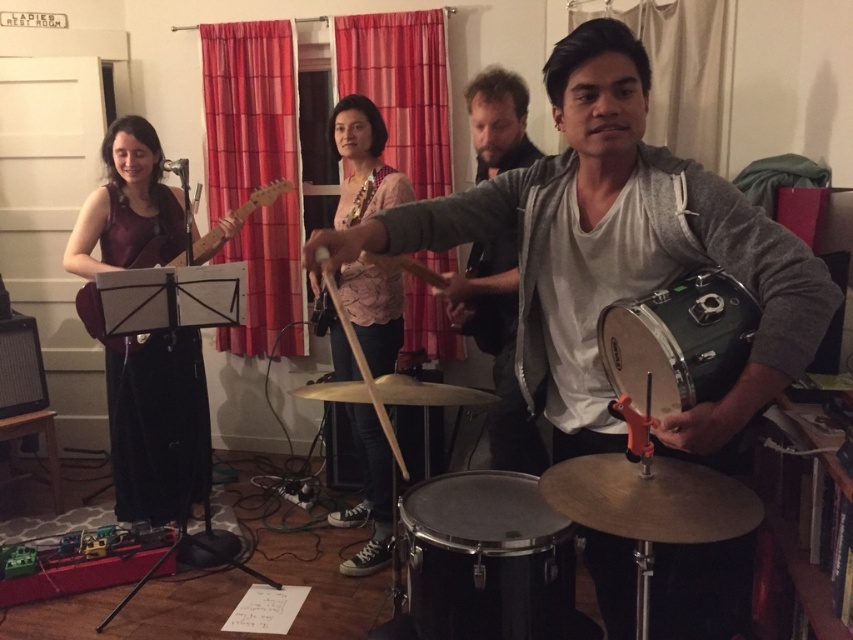
You are a photographer setting up for a group photo. You want to ensure that both the matte purple guitar at left and the matte pink shirt at center are visible in the frame. Based on their positions, which object should you adjust to avoid blocking the other?

The matte purple guitar at left is positioned under the matte pink shirt at center. To ensure both are visible, you should adjust the matte pink shirt at center to move it upwards or the guitar to move it downwards so they don not overlap.

You are a photographer trying to capture a group photo of the band members. You notice the matte pink shirt at center and the matte wood guitar at left. Which object should you focus on if you want to include both in the frame without cropping either, considering their sizes?

The matte pink shirt at center has a smaller width than the matte wood guitar at left. To include both without cropping, focus on the larger object, the matte wood guitar at left, as it requires more space in the frame.